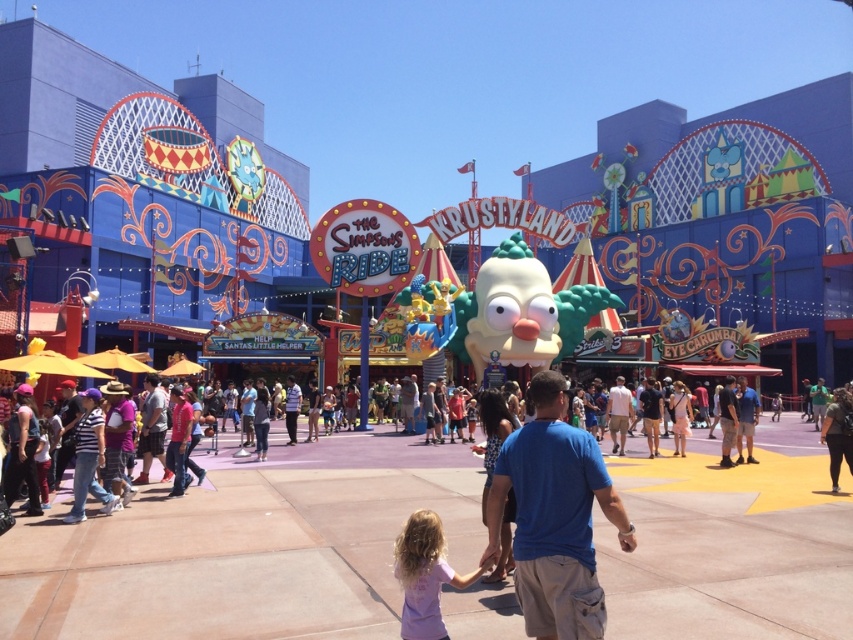
Who is taller, light blue shirt at center or striped shirt at center?

With more height is light blue shirt at center.

What do you see at coordinates (618, 413) in the screenshot? This screenshot has width=853, height=640. I see `light blue shirt at center` at bounding box center [618, 413].

Locate an element on the screen. light blue shirt at center is located at coordinates (618, 413).

Can you confirm if pink fabric dress at lower center is positioned below dark blue shirt at center?

Yes, pink fabric dress at lower center is below dark blue shirt at center.

Can you confirm if pink fabric dress at lower center is positioned to the right of dark blue shirt at center?

Correct, you'll find pink fabric dress at lower center to the right of dark blue shirt at center.

Which is in front, point (399, 576) or point (155, 432)?

Point (399, 576)

You are a GUI agent. You are given a task and a screenshot of the screen. Output one action in this format:
    pyautogui.click(x=<x>, y=<y>)
    Task: Click on the pink fabric dress at lower center
    This screenshot has height=640, width=853.
    Given the screenshot: What is the action you would take?
    pyautogui.click(x=425, y=576)

Can you confirm if dark blue shirt at center is smaller than striped shirt at center?

Yes, dark blue shirt at center is smaller than striped shirt at center.

Does dark blue shirt at center come behind striped shirt at center?

No, dark blue shirt at center is closer to the viewer.

Between point (154, 444) and point (294, 420), which one is positioned behind?

Positioned behind is point (294, 420).

Where is `dark blue shirt at center`? dark blue shirt at center is located at coordinates (152, 428).